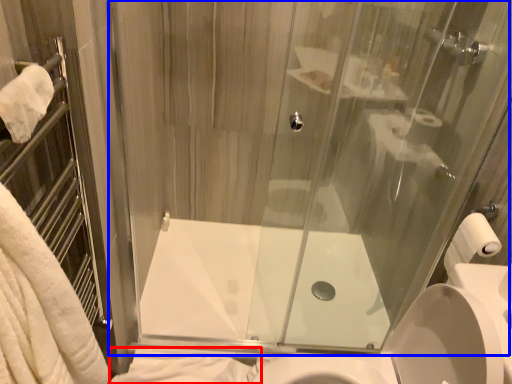
Question: Among these objects, which one is farthest to the camera, bath towel (highlighted by a red box) or glass door (highlighted by a blue box)?

Choices:
 (A) bath towel
 (B) glass door

Answer: (A)